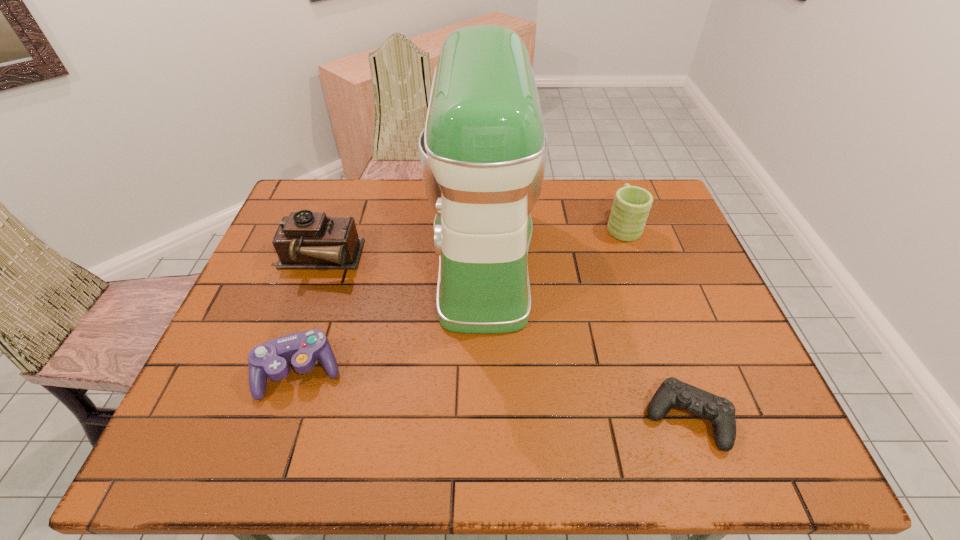
Where is `the tallest object`? The height and width of the screenshot is (540, 960). the tallest object is located at coordinates (483, 152).

You are a GUI agent. You are given a task and a screenshot of the screen. Output one action in this format:
    pyautogui.click(x=<x>, y=<y>)
    Task: Click on the third object from left to right
    
    Given the screenshot: What is the action you would take?
    pyautogui.click(x=483, y=152)

Identify the location of phonograph_record. The image size is (960, 540). (304, 240).

Locate an element on the screen. The width and height of the screenshot is (960, 540). mug is located at coordinates (631, 206).

Locate an element on the screen. This screenshot has height=540, width=960. the taller control is located at coordinates (302, 349).

Find the location of `the fourth tallest object`. the fourth tallest object is located at coordinates (302, 349).

Locate an element on the screen. This screenshot has width=960, height=540. the shorter control is located at coordinates (672, 392).

Where is `the shortest object`? the shortest object is located at coordinates (672, 392).

The image size is (960, 540). In order to click on vacant space situated 0.360m on the controls of the third object from right to left in this screenshot , I will do `click(302, 257)`.

This screenshot has width=960, height=540. I want to click on free location located on the controls of the third object from right to left, so [x=377, y=257].